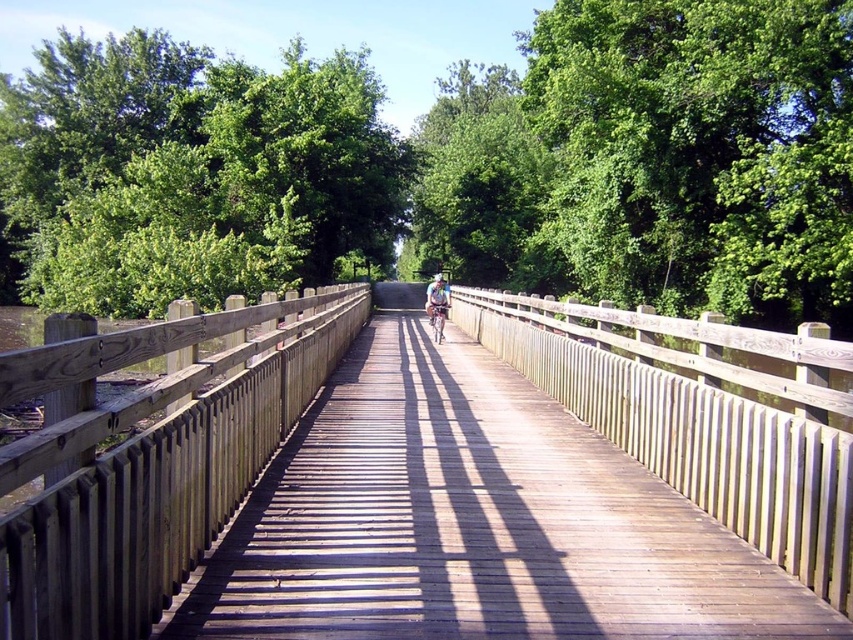
Question: Which point appears farthest from the camera in this image?

Choices:
 (A) (436, 305)
 (B) (440, 328)

Answer: (B)

Question: Can you confirm if wooden bridge at center is positioned to the left of white matte bicycle helmet at center?

Choices:
 (A) yes
 (B) no

Answer: (A)

Question: Observing the image, what is the correct spatial positioning of wooden bridge at center in reference to light blue fabric jacket at center?

Choices:
 (A) below
 (B) above

Answer: (A)

Question: Is wooden bridge at center to the right of metallic silver bicycle at center from the viewer's perspective?

Choices:
 (A) yes
 (B) no

Answer: (B)

Question: Among these points, which one is nearest to the camera?

Choices:
 (A) (440, 276)
 (B) (439, 300)

Answer: (B)

Question: Which object appears closest to the camera in this image?

Choices:
 (A) light blue fabric jacket at center
 (B) metallic silver bicycle at center
 (C) white matte bicycle helmet at center
 (D) wooden bridge at center

Answer: (D)